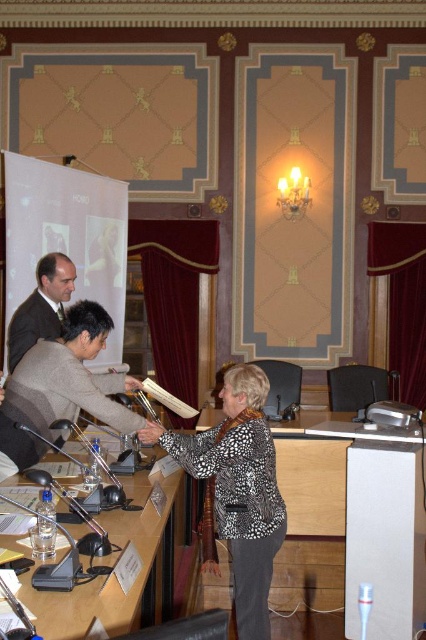
Who is taller, clear plastic table at center or dark brown suit at center?

dark brown suit at center

Who is more forward, (71, 625) or (40, 275)?

Point (71, 625)

Locate an element on the screen. The width and height of the screenshot is (426, 640). clear plastic table at center is located at coordinates (140, 568).

Can you confirm if wooden table at center is positioned to the left of dark gray suit at center?

No, wooden table at center is not to the left of dark gray suit at center.

Between point (417, 529) and point (51, 404), which one is positioned behind?

The point (417, 529) is behind.

Find the location of a particular element. The image size is (426, 640). wooden table at center is located at coordinates (359, 509).

Between point (316, 509) and point (138, 497), which one is positioned in front?

Point (138, 497)

Does wooden table at center have a lesser height compared to clear plastic table at center?

No.

Who is more distant from viewer, (278, 435) or (69, 621)?

Positioned behind is point (278, 435).

Where is `wooden table at center`? wooden table at center is located at coordinates (359, 509).